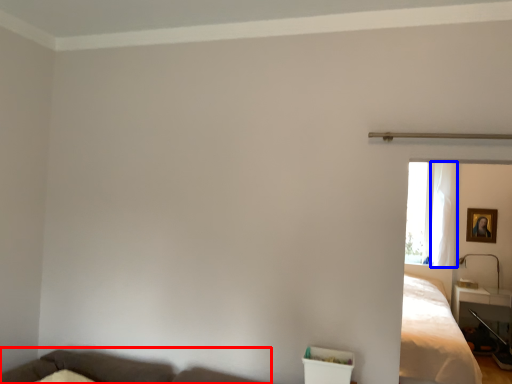
Question: Which object appears farthest to the camera in this image, couch (highlighted by a red box) or curtain (highlighted by a blue box)?

Choices:
 (A) couch
 (B) curtain

Answer: (B)